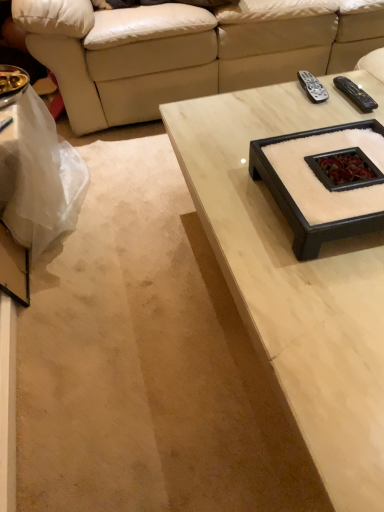
Identify the location of free space in front of white plastic bag at lower left. Image resolution: width=384 pixels, height=512 pixels. (96, 319).